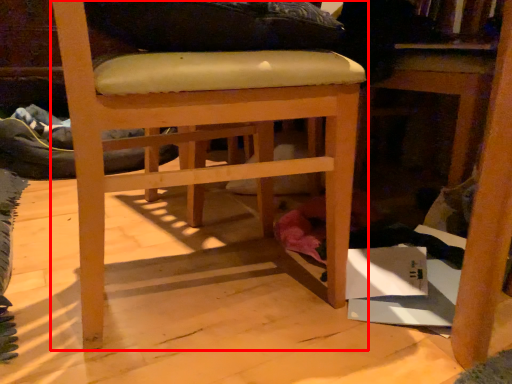
Question: From the image, what is the correct spatial relationship of chair (annotated by the red box) in relation to table?

Choices:
 (A) right
 (B) left

Answer: (B)